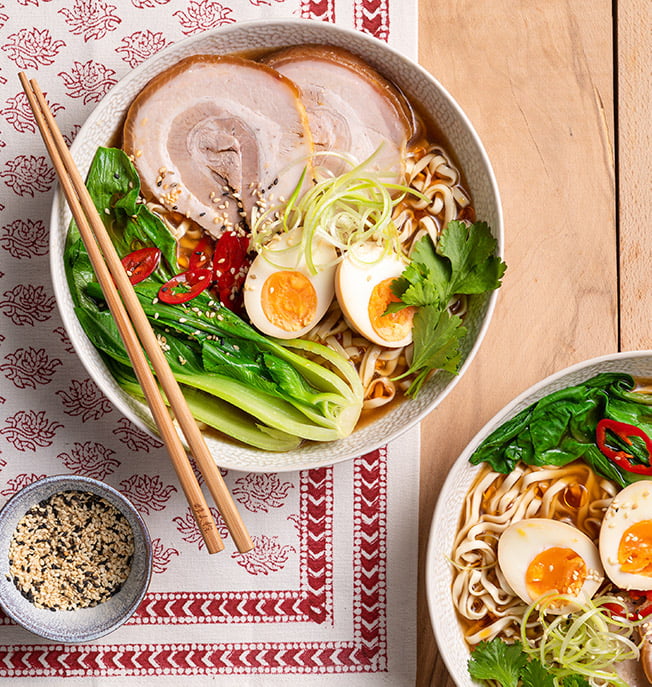
This screenshot has height=687, width=652. Find the location of `silver bowl`. silver bowl is located at coordinates click(125, 604).